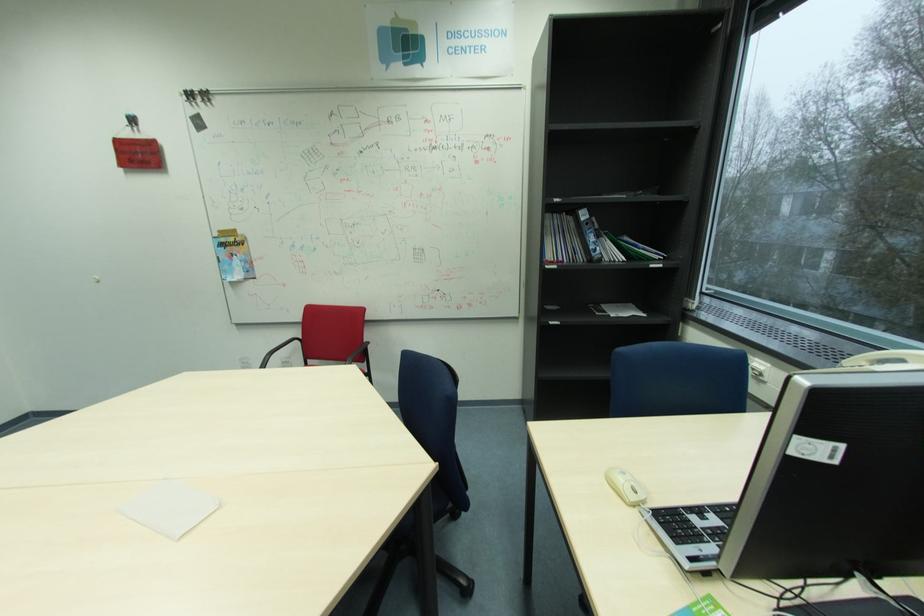
Find where to typ the laptop keyboard. Please return your answer as a coordinate pair (x, y).

(699, 548)